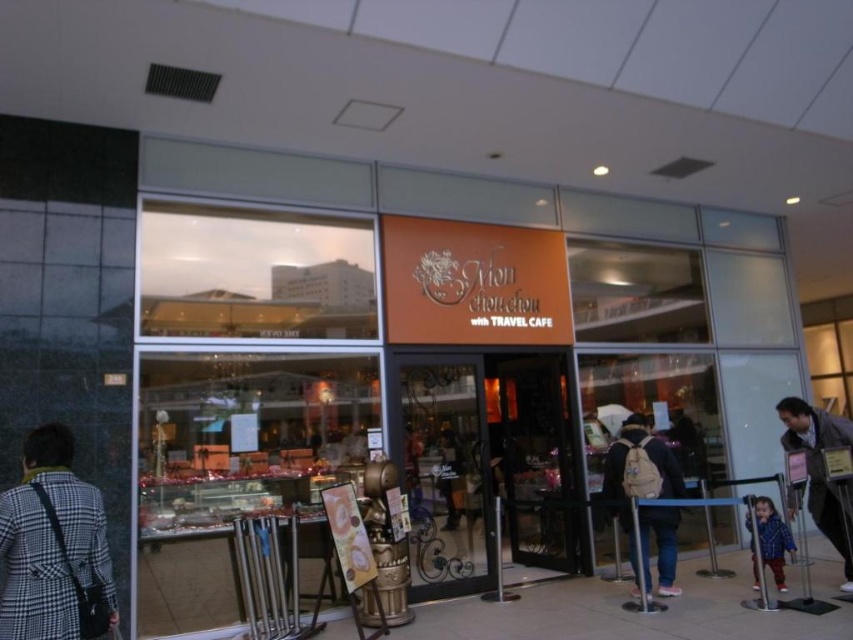
In the scene shown: You are standing outside the Mom Chou Chou with TRAVEL CAFE. You want to take a photo of the entrance sign that includes both the main name and the smaller text below it. If you are currently at point (74, 476), which is 4.73 meters away from the sign, is this distance sufficient to capture both parts of the sign in one frame?

The distance of point (74, 476) from viewer is 4.73 meters. This distance may be sufficient if your camera has a wide enough lens to capture both the main name and the smaller text below it at that range. However, if the sign is vertically large, you might need to adjust your position or use a wider angle lens to ensure both parts are in frame.

You are a traveler who just arrived at the Mom Chou Chou with TRAVEL CAFE. You notice a beige fabric backpack at center and a blue plaid shirt at lower right. Which item is bigger in size?

The beige fabric backpack at center is larger in size than the blue plaid shirt at lower right.